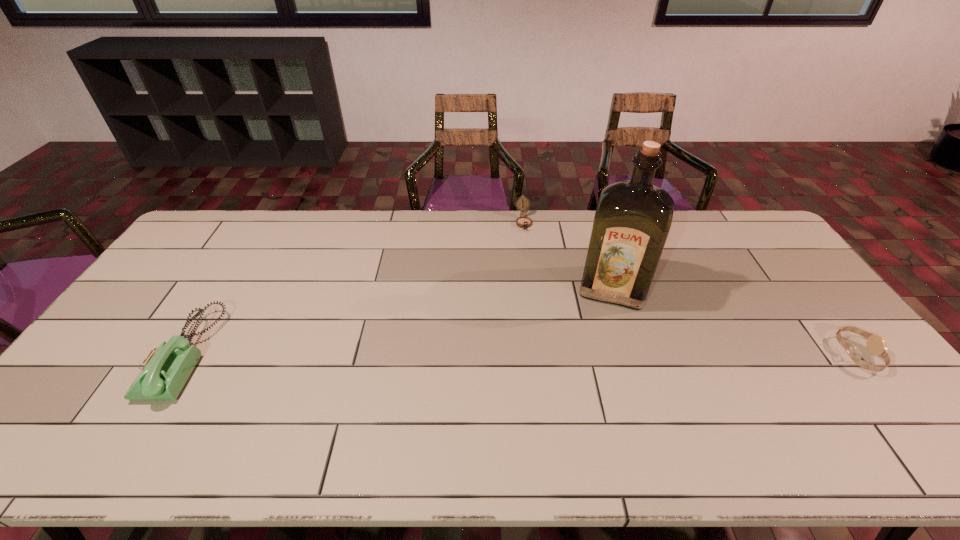
Find the location of a particular element. The width and height of the screenshot is (960, 540). vacant point located between the telephone and the farthest object is located at coordinates (354, 288).

At what (x,y) coordinates should I click in order to perform the action: click on free space between the second shortest object and the liquor. Please return your answer as a coordinate pair (x, y). The width and height of the screenshot is (960, 540). Looking at the image, I should click on (568, 255).

Locate an element on the screen. Image resolution: width=960 pixels, height=540 pixels. vacant space that's between the tallest object and the watch is located at coordinates (735, 321).

Locate an element on the screen. Image resolution: width=960 pixels, height=540 pixels. vacant area that lies between the second tallest object and the watch is located at coordinates coord(521,354).

At what (x,y) coordinates should I click in order to perform the action: click on empty location between the compass and the tallest object. Please return your answer as a coordinate pair (x, y). This screenshot has height=540, width=960. Looking at the image, I should click on (568, 255).

This screenshot has width=960, height=540. In order to click on object that is the third closest to the second object from right to left in this screenshot , I will do `click(164, 372)`.

Locate an element on the screen. The image size is (960, 540). object that stands as the third closest to the liquor is located at coordinates (164, 372).

The height and width of the screenshot is (540, 960). Find the location of `free point that satisfies the following two spatial constraints: 1. on the front side of the third tallest object; 2. on the right side of the tallest object`. free point that satisfies the following two spatial constraints: 1. on the front side of the third tallest object; 2. on the right side of the tallest object is located at coordinates (532, 288).

I want to click on vacant region that satisfies the following two spatial constraints: 1. on the front side of the liquor; 2. on the face of the shortest object, so click(x=635, y=355).

In order to click on free space that satisfies the following two spatial constraints: 1. on the front side of the watch; 2. on the face of the second object from left to right in this screenshot , I will do `click(540, 355)`.